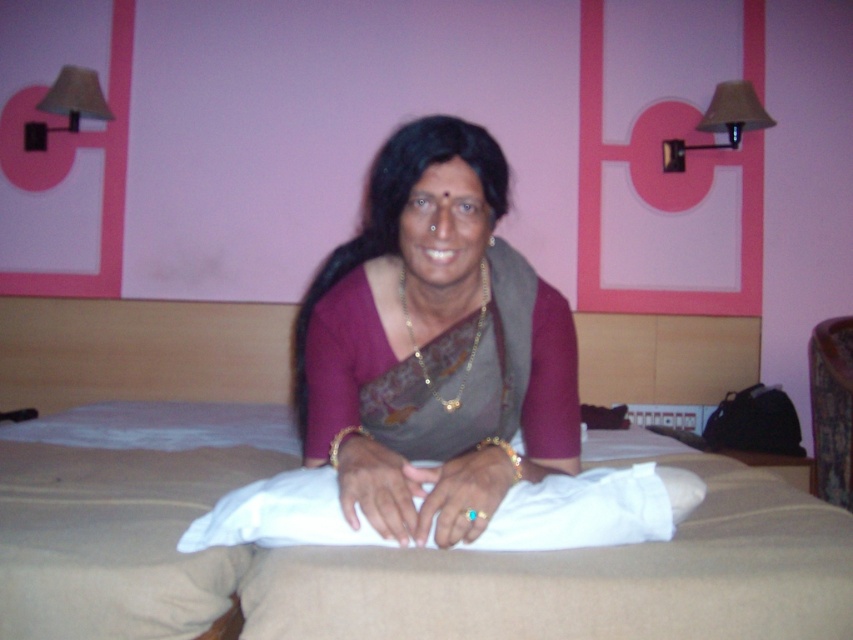
Between beige fabric bed at center and matte gray sari at center, which one is positioned higher?

Positioned higher is matte gray sari at center.

Is point (131, 627) less distant than point (502, 493)?

Yes, point (131, 627) is in front of point (502, 493).

Find the location of a particular element. beige fabric bed at center is located at coordinates (397, 563).